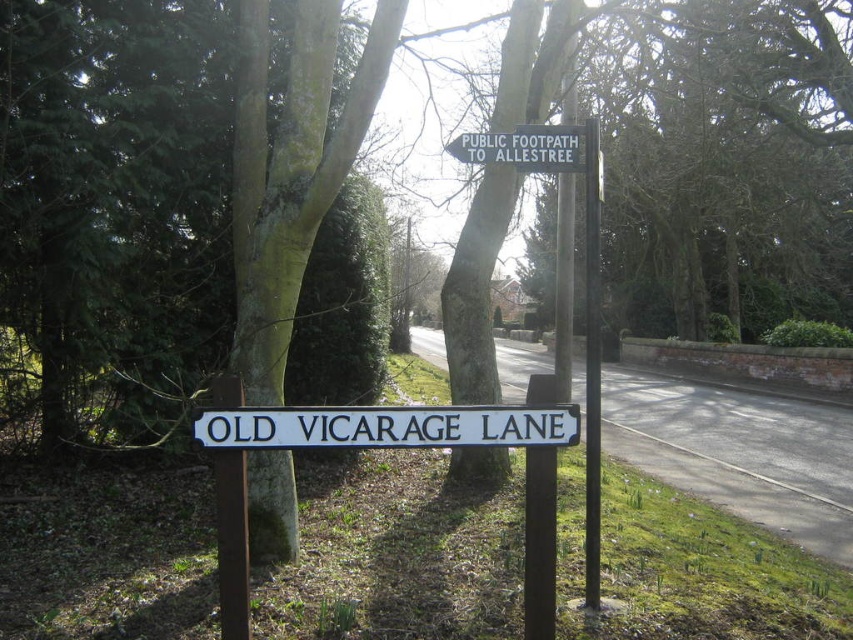
From the picture: You are a hiker trying to read the white plastic sign at upper center but notice the green rough bark tree at center is blocking your view. Can you move around the tree to see the sign clearly?

The white plastic sign at upper center is behind the green rough bark tree at center, so moving around the tree might allow you to see the sign if there are no other obstructions.

You are standing at the point marked by the coordinates point [184,211] in the image. What object is located exactly at this point?

The point [184,211] corresponds to the green rough bark tree at center.

Based on the photo, you are standing at the point marked by the coordinates point (184, 211) in the image. What is the nearest object to you?

The nearest object to you is the green rough bark tree at center, as the point (184, 211) is located on it.